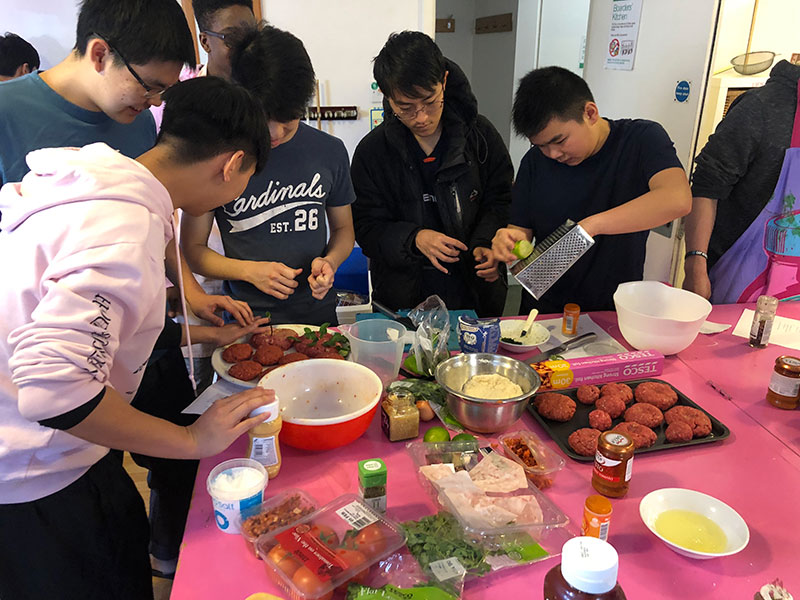
At what (x,y) coordinates should I click in order to perform the action: click on red bowl. Please return your answer as a coordinate pair (x, y). Looking at the image, I should click on (325, 433).